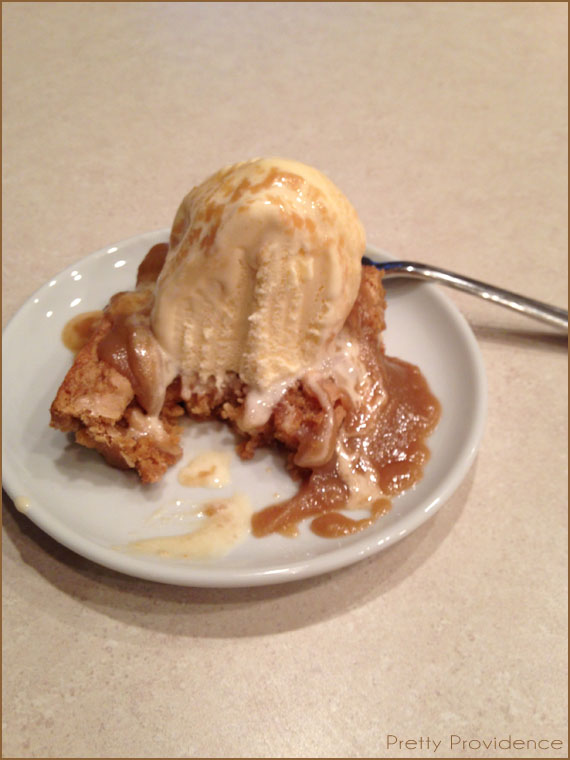
Where is `edge of the plate`? The image size is (570, 760). edge of the plate is located at coordinates (450, 485).